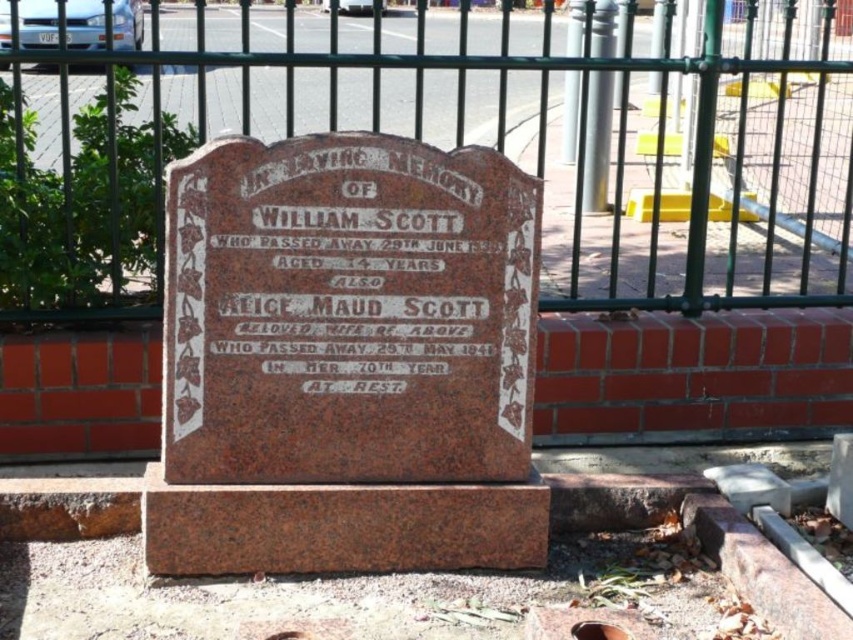
You are standing at the camera position and want to place a wreath on the brown polished stone plaque at center. If your arm reaches 8 feet, can you reach the plaque without moving?

The brown polished stone plaque at center and camera are 8.33 feet apart. Since your arm reaches 8 feet, you cannot reach the plaque without moving closer.

You are a visitor at the cemetery and see the green metal fence at upper center and the white painted stone at center. Which object would block your view more if you were standing in front of them?

The green metal fence at upper center is larger in size than the white painted stone at center, so it would block your view more.

You are a landscape architect designing a new cemetery layout. You need to place a pathway between the green metal fence at upper center and the brown polished stone plaque at center. Since the pathway must be at least 1.2 meters wide to accommodate wheelchairs, can the existing space between them accommodate this requirement based on their widths?

The green metal fence at upper center is wider than the brown polished stone plaque at center. However, the description only states their relative widths, not the exact measurements. Without knowing the specific width of the pathway between them, it is impossible to determine if it meets the 1.2 meter requirement.